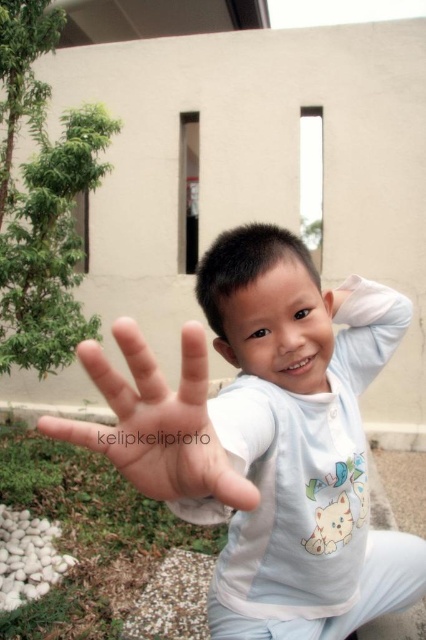
Based on the scene description, can you determine which object is closer to the camera between the smooth skin hand at center and the white cotton shirt at center?

The smooth skin hand at center is behind the white cotton shirt at center, so the white cotton shirt at center is closer to the camera.

From the picture: The child is wearing a white cotton shirt at center and has a smooth skin hand at center visible. Which of these two items is wider?

The white cotton shirt at center is wider than the smooth skin hand at center.

The child in the image is wearing a white cotton shirt at center and has a smooth skin hand at center. Which of these is located lower in the picture?

The white cotton shirt at center is located below the smooth skin hand at center, so the white cotton shirt at center is lower in the picture.